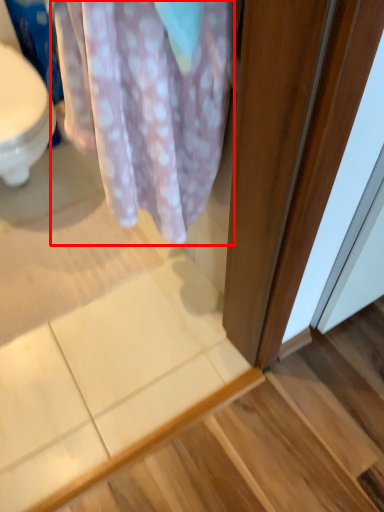
Question: From the image's perspective, what is the correct spatial positioning of blanket (annotated by the red box) in reference to stair?

Choices:
 (A) above
 (B) below

Answer: (A)